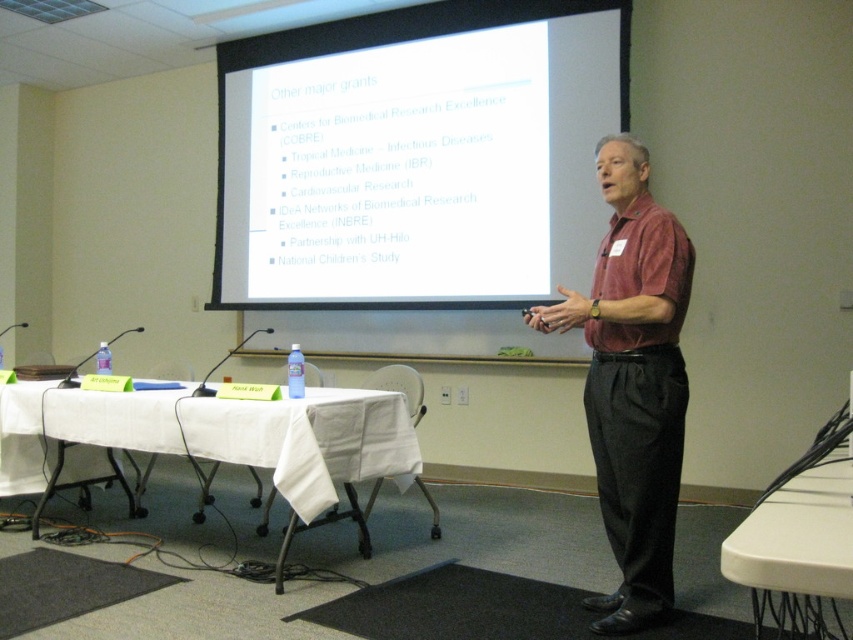
You are attending a presentation and need to place your laptop on the nearest available surface. You see the matte red shirt at center and the white plastic table at lower right. Which object is closer to you?

The white plastic table at lower right is behind the matte red shirt at center, so the matte red shirt at center is closer to you.